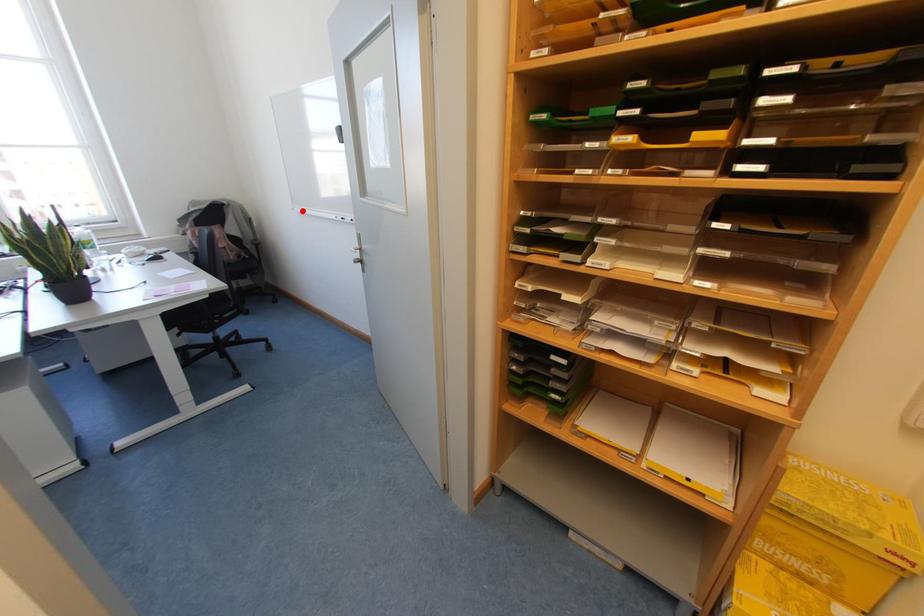
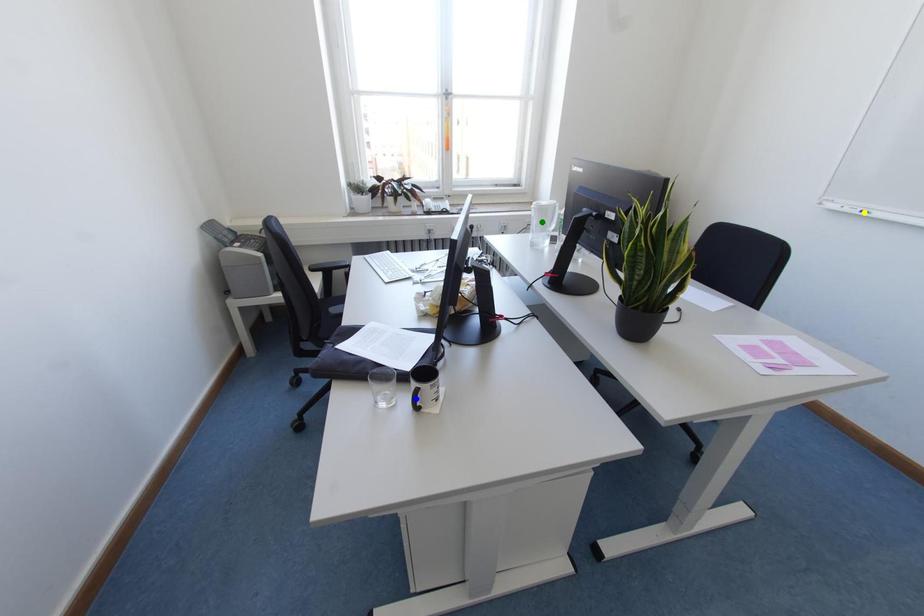
Question: I am providing you with two images of the same scene from different viewpoints. A red point is marked on the first image. You are given multiple points on the second image. Can you choose the point in image 2 that corresponds to the point in image 1?

Choices:
 (A) green point
 (B) blue point
 (C) yellow point

Answer: (C)